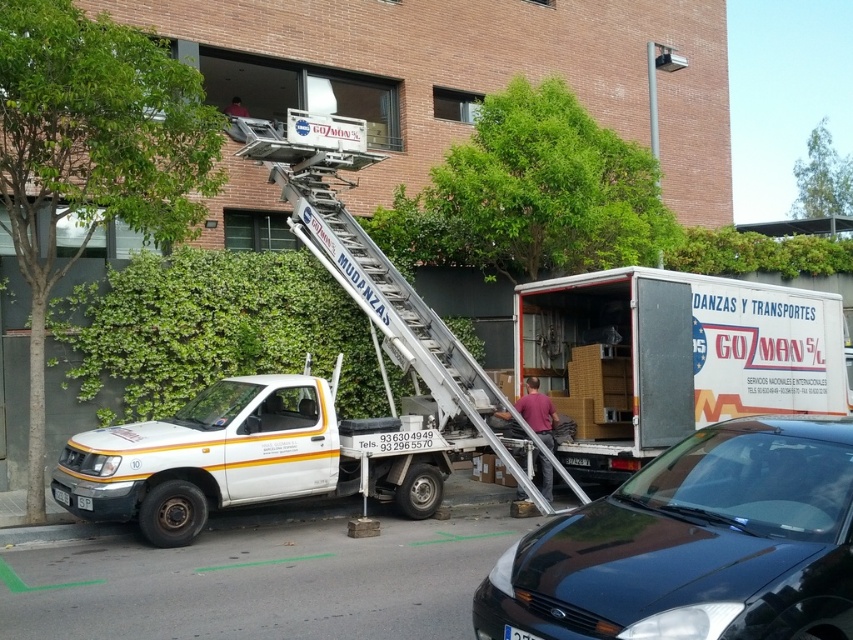
Which is more to the left, metallic silver ladder at center or black plastic license plate at lower center?

metallic silver ladder at center

Is metallic silver ladder at center taller than black plastic license plate at lower center?

Yes, metallic silver ladder at center is taller than black plastic license plate at lower center.

Between point (404, 301) and point (531, 634), which one is positioned behind?

The point (404, 301) is behind.

At what (x,y) coordinates should I click in order to perform the action: click on metallic silver ladder at center. Please return your answer as a coordinate pair (x, y). Image resolution: width=853 pixels, height=640 pixels. Looking at the image, I should click on (405, 321).

Which is below, white cardboard boxes at center or black plastic license plate at lower center?

black plastic license plate at lower center

Between white cardboard boxes at center and black plastic license plate at lower center, which one is positioned higher?

Positioned higher is white cardboard boxes at center.

Where is `white cardboard boxes at center`? This screenshot has width=853, height=640. white cardboard boxes at center is located at coordinates (672, 356).

Find the location of `white cardboard boxes at center`. white cardboard boxes at center is located at coordinates (672, 356).

This screenshot has height=640, width=853. What do you see at coordinates (517, 634) in the screenshot? I see `black plastic license plate at lower center` at bounding box center [517, 634].

In the scene shown: Who is more distant from viewer, (509, 628) or (84, 499)?

The point (84, 499) is more distant.

Locate an element on the screen. The height and width of the screenshot is (640, 853). black plastic license plate at lower center is located at coordinates (517, 634).